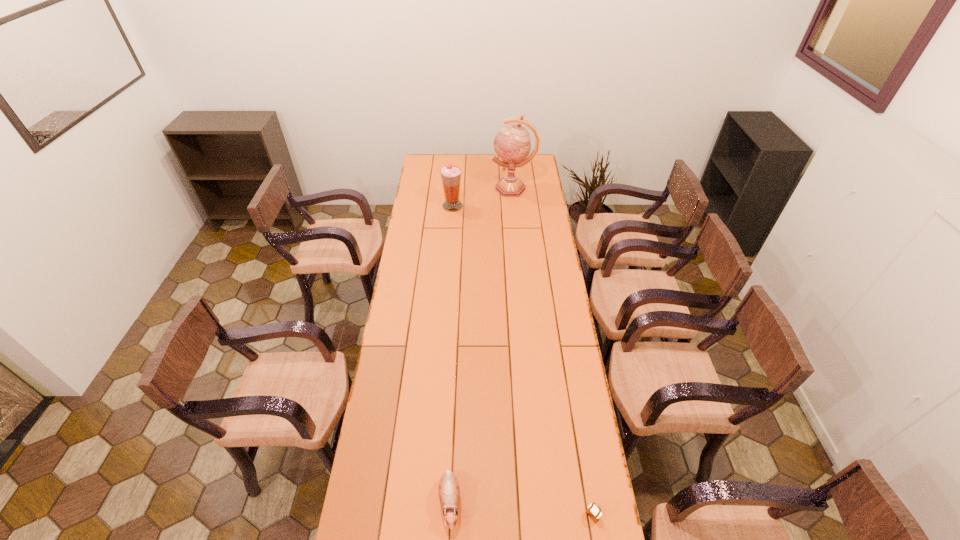
Image resolution: width=960 pixels, height=540 pixels. I want to click on vacant point that satisfies the following two spatial constraints: 1. on the front-facing side of the globe; 2. at the face of the hamster, so click(x=541, y=502).

I want to click on blank area in the image that satisfies the following two spatial constraints: 1. on the front-facing side of the farthest object; 2. on the left side of the padlock, so click(542, 515).

Where is `vacant space that satisfies the following two spatial constraints: 1. at the face of the padlock; 2. on the right side of the hamster`? The width and height of the screenshot is (960, 540). vacant space that satisfies the following two spatial constraints: 1. at the face of the padlock; 2. on the right side of the hamster is located at coordinates (449, 515).

Image resolution: width=960 pixels, height=540 pixels. Find the location of `vacant area in the image that satisfies the following two spatial constraints: 1. on the front-facing side of the tallest object; 2. on the right side of the padlock`. vacant area in the image that satisfies the following two spatial constraints: 1. on the front-facing side of the tallest object; 2. on the right side of the padlock is located at coordinates click(542, 515).

In order to click on vacant region that satisfies the following two spatial constraints: 1. on the front-facing side of the farthest object; 2. on the front side of the third shortest object in this screenshot , I will do `click(515, 206)`.